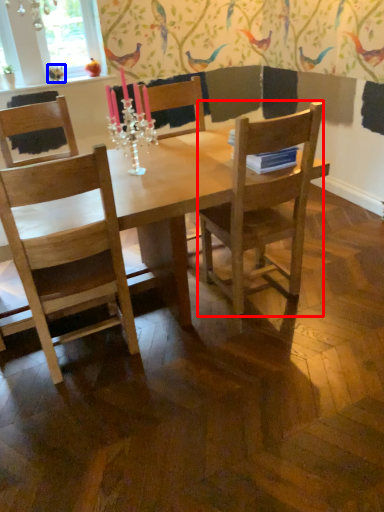
Question: Which object appears farthest to the camera in this image, chair (highlighted by a red box) or bird (highlighted by a blue box)?

Choices:
 (A) chair
 (B) bird

Answer: (B)